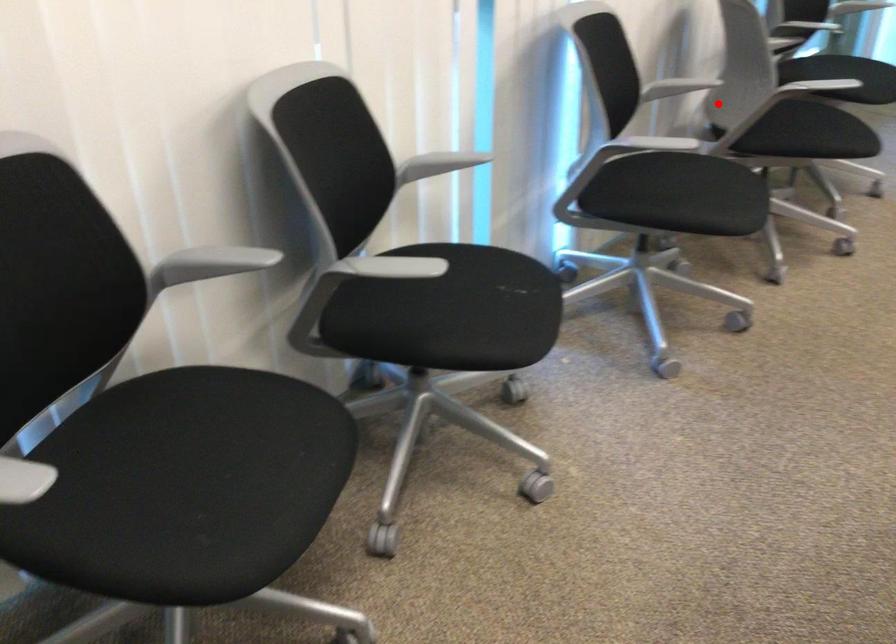
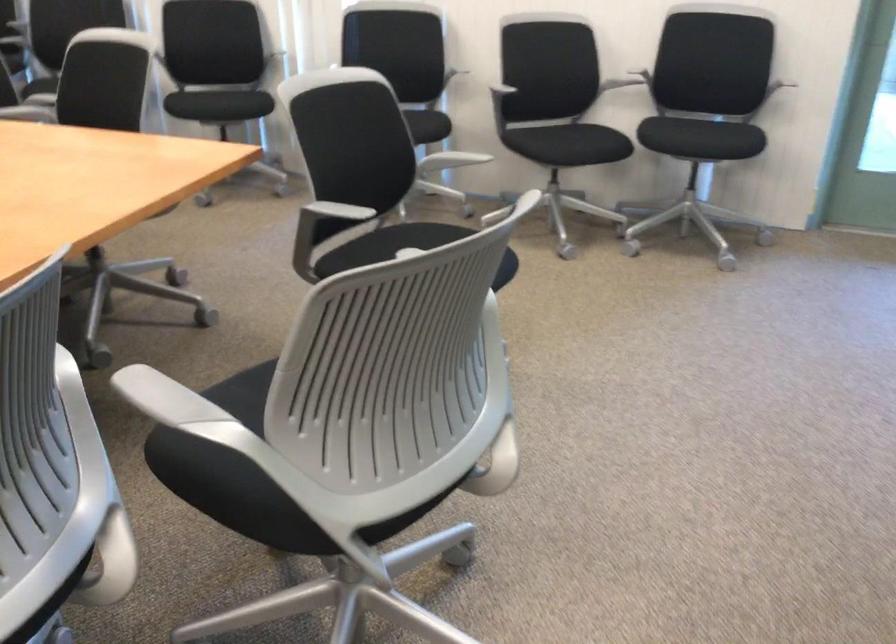
Question: I am providing you with two images of the same scene from different viewpoints. Given a red point in image1, look at the same physical point in image2. Is it:

Choices:
 (A) Closer to the viewpoint
 (B) Farther from the viewpoint

Answer: (B)